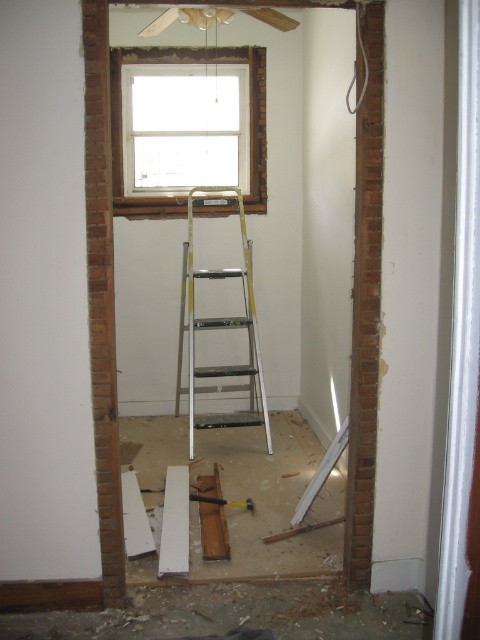
Is point (173, 529) closer to viewer compared to point (208, 500)?

Yes.

At what (x,y) coordinates should I click in order to perform the action: click on white matte beam at center. Please return your answer as a coordinate pair (x, y). Looking at the image, I should click on (175, 522).

Is silver/aluminum step ladder at center bigger than white matte beam at center?

Indeed, silver/aluminum step ladder at center has a larger size compared to white matte beam at center.

Does point (251, 310) come farther from viewer compared to point (169, 484)?

Yes.

Is point (252, 317) farther from camera compared to point (173, 509)?

Yes, it is.

You are a GUI agent. You are given a task and a screenshot of the screen. Output one action in this format:
    pyautogui.click(x=<x>, y=<y>)
    Task: Click on the silver/aluminum step ladder at center
    The height and width of the screenshot is (640, 480).
    Given the screenshot: What is the action you would take?
    pyautogui.click(x=217, y=328)

Is point (332, 456) behind point (228, 500)?

No, it is not.

What do you see at coordinates (322, 472) in the screenshot? Image resolution: width=480 pixels, height=640 pixels. I see `white plastic beam at lower right` at bounding box center [322, 472].

The height and width of the screenshot is (640, 480). What do you see at coordinates (322, 472) in the screenshot?
I see `white plastic beam at lower right` at bounding box center [322, 472].

Locate an element on the screen. white plastic beam at lower right is located at coordinates (322, 472).